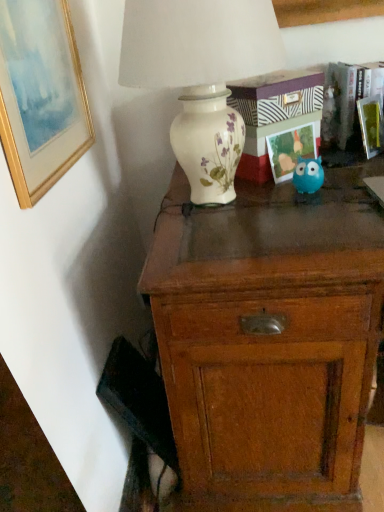
Question: Is gold-framed painting at upper left, marked as the third picture frame in a right-to-left arrangement, thinner than green matte picture frame at upper right, the third picture frame when ordered from left to right?

Choices:
 (A) no
 (B) yes

Answer: (B)

Question: Is gold-framed painting at upper left, marked as the third picture frame in a right-to-left arrangement, facing towards green matte picture frame at upper right, the 1th picture frame viewed from the right?

Choices:
 (A) no
 (B) yes

Answer: (B)

Question: From a real-world perspective, is gold-framed painting at upper left, marked as the third picture frame in a right-to-left arrangement, on top of green matte picture frame at upper right, the third picture frame when ordered from left to right?

Choices:
 (A) yes
 (B) no

Answer: (A)

Question: Is gold-framed painting at upper left, which is counted as the 1th picture frame, starting from the left, positioned beyond the bounds of green matte picture frame at upper right, the 1th picture frame viewed from the right?

Choices:
 (A) no
 (B) yes

Answer: (B)

Question: Is gold-framed painting at upper left, which is counted as the 1th picture frame, starting from the left, wider than green matte picture frame at upper right, the third picture frame when ordered from left to right?

Choices:
 (A) yes
 (B) no

Answer: (B)

Question: Would you say gold-framed painting at upper left, marked as the third picture frame in a right-to-left arrangement, contains green matte picture frame at upper right, the 1th picture frame viewed from the right?

Choices:
 (A) yes
 (B) no

Answer: (B)

Question: Is matte plastic picture frame at upper right, acting as the second picture frame starting from the left, inside white ceramic vase at upper center?

Choices:
 (A) yes
 (B) no

Answer: (B)

Question: From a real-world perspective, is white ceramic vase at upper center over matte plastic picture frame at upper right, marked as the 2th picture frame in a right-to-left arrangement?

Choices:
 (A) yes
 (B) no

Answer: (A)

Question: Is white ceramic vase at upper center in contact with matte plastic picture frame at upper right, acting as the second picture frame starting from the left?

Choices:
 (A) yes
 (B) no

Answer: (B)

Question: From the image's perspective, does white ceramic vase at upper center appear lower than matte plastic picture frame at upper right, acting as the second picture frame starting from the left?

Choices:
 (A) yes
 (B) no

Answer: (B)

Question: Is the depth of white ceramic vase at upper center greater than that of matte plastic picture frame at upper right, marked as the 2th picture frame in a right-to-left arrangement?

Choices:
 (A) yes
 (B) no

Answer: (B)

Question: Is white ceramic vase at upper center closer to camera compared to matte plastic picture frame at upper right, marked as the 2th picture frame in a right-to-left arrangement?

Choices:
 (A) yes
 (B) no

Answer: (A)

Question: From a real-world perspective, is matte plastic picture frame at upper right, marked as the 2th picture frame in a right-to-left arrangement, positioned over gold-framed painting at upper left, which is counted as the 1th picture frame, starting from the left, based on gravity?

Choices:
 (A) no
 (B) yes

Answer: (A)